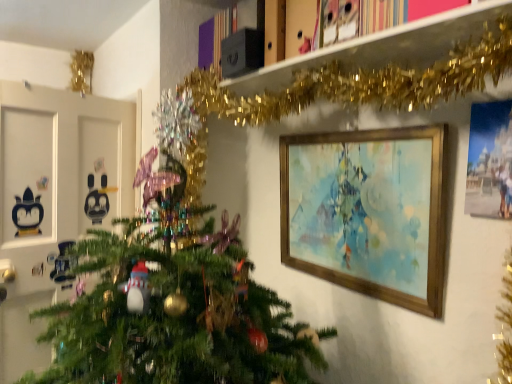
The height and width of the screenshot is (384, 512). In order to click on wooden picture frame at upper right, the second picture frame when ordered from front to back in this screenshot , I will do `click(367, 212)`.

The height and width of the screenshot is (384, 512). What do you see at coordinates (362, 83) in the screenshot?
I see `gold tinsel garland at upper center` at bounding box center [362, 83].

Find the location of `gold tinsel garland at upper center`. gold tinsel garland at upper center is located at coordinates (362, 83).

Where is `matte blue painting at upper right, which is the 2th picture frame in left-to-right order`? Image resolution: width=512 pixels, height=384 pixels. matte blue painting at upper right, which is the 2th picture frame in left-to-right order is located at coordinates (490, 161).

Between point (336, 61) and point (396, 186), which one is positioned behind?

The point (336, 61) is more distant.

Considering the sizes of objects gold tinsel garland at upper center and wooden picture frame at upper right, which is the first picture frame from left to right, in the image provided, who is smaller, gold tinsel garland at upper center or wooden picture frame at upper right, which is the first picture frame from left to right,?

Smaller between the two is gold tinsel garland at upper center.

Can you confirm if gold tinsel garland at upper center is taller than wooden picture frame at upper right, the second picture frame when ordered from front to back?

In fact, gold tinsel garland at upper center may be shorter than wooden picture frame at upper right, the second picture frame when ordered from front to back.

Can you confirm if matte blue painting at upper right, positioned as the 1th picture frame in front-to-back order, is thinner than wooden picture frame at upper right, the second picture frame when ordered from front to back?

Correct, the width of matte blue painting at upper right, positioned as the 1th picture frame in front-to-back order, is less than that of wooden picture frame at upper right, the second picture frame when ordered from front to back.

Measure the distance between matte blue painting at upper right, which is the 2th picture frame in left-to-right order, and wooden picture frame at upper right, the second picture frame when ordered from front to back.

They are 12.31 inches apart.

Which is less distant, (506, 106) or (415, 293)?

The point (506, 106) is more forward.

Is wooden picture frame at upper right, the second picture frame when ordered from front to back, smaller than gold tinsel garland at upper center?

No.

From a real-world perspective, which object stands above the other?

From a 3D spatial view, gold tinsel garland at upper center is above.

Considering the positions of objects wooden picture frame at upper right, arranged as the first picture frame when viewed from the back, and gold tinsel garland at upper center in the image provided, who is more to the right, wooden picture frame at upper right, arranged as the first picture frame when viewed from the back, or gold tinsel garland at upper center?

wooden picture frame at upper right, arranged as the first picture frame when viewed from the back, is more to the right.

Who is shorter, wooden picture frame at upper right, marked as the second picture frame in a right-to-left arrangement, or gold tinsel garland at upper center?

Standing shorter between the two is gold tinsel garland at upper center.

In order to click on picture frame that is the 2nd object to the right of the gold tinsel garland at upper center, starting at the anchor in this screenshot , I will do tap(490, 161).

Does gold tinsel garland at upper center appear on the right side of matte blue painting at upper right, positioned as the 1th picture frame in front-to-back order?

In fact, gold tinsel garland at upper center is to the left of matte blue painting at upper right, positioned as the 1th picture frame in front-to-back order.

Does wooden picture frame at upper right, marked as the second picture frame in a right-to-left arrangement, appear on the right side of matte blue painting at upper right, acting as the 1th picture frame starting from the right?

Incorrect, wooden picture frame at upper right, marked as the second picture frame in a right-to-left arrangement, is not on the right side of matte blue painting at upper right, acting as the 1th picture frame starting from the right.

How many degrees apart are the facing directions of wooden picture frame at upper right, marked as the second picture frame in a right-to-left arrangement, and matte blue painting at upper right, which appears as the second picture frame when viewed from the back?

The facing directions of wooden picture frame at upper right, marked as the second picture frame in a right-to-left arrangement, and matte blue painting at upper right, which appears as the second picture frame when viewed from the back, are 0.571 degrees apart.

From the image's perspective, between wooden picture frame at upper right, marked as the second picture frame in a right-to-left arrangement, and matte blue painting at upper right, which appears as the second picture frame when viewed from the back, which one is located above?

matte blue painting at upper right, which appears as the second picture frame when viewed from the back, is shown above in the image.

How much distance is there between wooden picture frame at upper right, which is the first picture frame from left to right, and matte blue painting at upper right, positioned as the 1th picture frame in front-to-back order?

The distance of wooden picture frame at upper right, which is the first picture frame from left to right, from matte blue painting at upper right, positioned as the 1th picture frame in front-to-back order, is 12.31 inches.

Which is behind, matte blue painting at upper right, acting as the 1th picture frame starting from the right, or gold tinsel garland at upper center?

matte blue painting at upper right, acting as the 1th picture frame starting from the right, is further from the camera.

Does point (501, 206) lie in front of point (306, 91)?

Yes, point (501, 206) is closer to viewer.

Measure the distance from matte blue painting at upper right, positioned as the 1th picture frame in front-to-back order, to gold tinsel garland at upper center.

matte blue painting at upper right, positioned as the 1th picture frame in front-to-back order, is 14.67 inches away from gold tinsel garland at upper center.

Image resolution: width=512 pixels, height=384 pixels. Find the location of `picture frame that is the 2nd object located below the gold tinsel garland at upper center (from the image's perspective)`. picture frame that is the 2nd object located below the gold tinsel garland at upper center (from the image's perspective) is located at coordinates (367, 212).

This screenshot has width=512, height=384. What are the coordinates of `picture frame below the matte blue painting at upper right, which is the 2th picture frame in left-to-right order (from a real-world perspective)` in the screenshot? It's located at (367, 212).

When comparing their distances from gold tinsel garland at upper center, does wooden picture frame at upper right, which is the first picture frame from left to right, or matte blue painting at upper right, positioned as the 1th picture frame in front-to-back order, seem closer?

Based on the image, wooden picture frame at upper right, which is the first picture frame from left to right, appears to be nearer to gold tinsel garland at upper center.

From the picture: Which object lies further to the anchor point matte blue painting at upper right, which is the 2th picture frame in left-to-right order, wooden picture frame at upper right, which is the first picture frame from left to right, or gold tinsel garland at upper center?

Among the two, gold tinsel garland at upper center is located further to matte blue painting at upper right, which is the 2th picture frame in left-to-right order.

From the image, which object appears to be nearer to matte blue painting at upper right, which appears as the second picture frame when viewed from the back, gold tinsel garland at upper center or wooden picture frame at upper right, which is the first picture frame from left to right?

Based on the image, wooden picture frame at upper right, which is the first picture frame from left to right, appears to be nearer to matte blue painting at upper right, which appears as the second picture frame when viewed from the back.

When comparing their distances from wooden picture frame at upper right, marked as the second picture frame in a right-to-left arrangement, does matte blue painting at upper right, which is the 2th picture frame in left-to-right order, or gold tinsel garland at upper center seem further?

The object further to wooden picture frame at upper right, marked as the second picture frame in a right-to-left arrangement, is gold tinsel garland at upper center.

From the image, which object appears to be nearer to gold tinsel garland at upper center, matte blue painting at upper right, which is the 2th picture frame in left-to-right order, or wooden picture frame at upper right, the second picture frame when ordered from front to back?

wooden picture frame at upper right, the second picture frame when ordered from front to back, is positioned closer to the anchor gold tinsel garland at upper center.

Looking at the image, which one is located further to wooden picture frame at upper right, marked as the second picture frame in a right-to-left arrangement, gold tinsel garland at upper center or matte blue painting at upper right, acting as the 1th picture frame starting from the right?

gold tinsel garland at upper center.

I want to click on picture frame between gold tinsel garland at upper center and wooden picture frame at upper right, marked as the second picture frame in a right-to-left arrangement, vertically, so click(x=490, y=161).